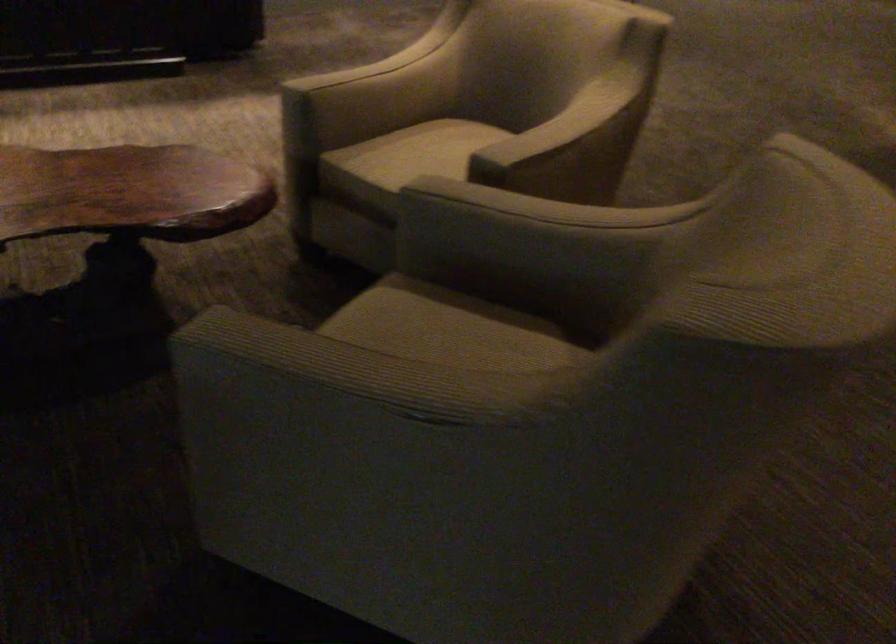
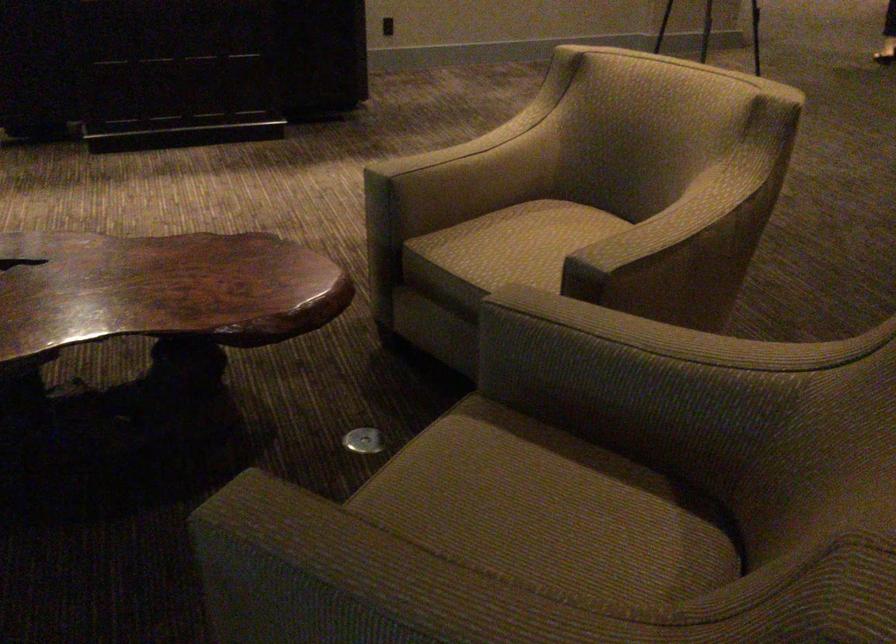
The point at (437, 153) is marked in the first image. Where is the corresponding point in the second image?

(535, 242)